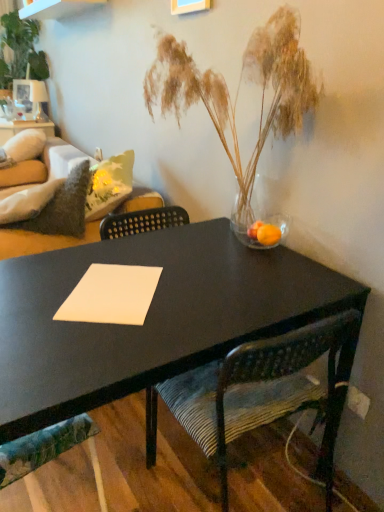
Question: Is textured fabric chair at lower left, which is counted as the 1th chair, starting from the left, at the left side of velvet green couch at left?

Choices:
 (A) yes
 (B) no

Answer: (B)

Question: Does textured fabric chair at lower left, which is counted as the 1th chair, starting from the left, come in front of velvet green couch at left?

Choices:
 (A) no
 (B) yes

Answer: (B)

Question: From a real-world perspective, is textured fabric chair at lower left, which is counted as the 1th chair, starting from the left, located beneath velvet green couch at left?

Choices:
 (A) yes
 (B) no

Answer: (A)

Question: Is textured fabric chair at lower left, which is counted as the 1th chair, starting from the left, surrounding velvet green couch at left?

Choices:
 (A) no
 (B) yes

Answer: (A)

Question: Is textured fabric chair at lower left, which is counted as the 1th chair, starting from the left, smaller than velvet green couch at left?

Choices:
 (A) yes
 (B) no

Answer: (A)

Question: Does textured fabric chair at lower left, arranged as the second chair when viewed from the right, turn towards velvet green couch at left?

Choices:
 (A) yes
 (B) no

Answer: (B)

Question: Is textured fabric chair at lower left, which is counted as the 1th chair, starting from the left, inside white fluffy pillow at upper left?

Choices:
 (A) yes
 (B) no

Answer: (B)

Question: Is white fluffy pillow at upper left completely or partially outside of textured fabric chair at lower left, arranged as the second chair when viewed from the right?

Choices:
 (A) no
 (B) yes

Answer: (B)

Question: Is white fluffy pillow at upper left thinner than textured fabric chair at lower left, arranged as the second chair when viewed from the right?

Choices:
 (A) yes
 (B) no

Answer: (B)

Question: Is white fluffy pillow at upper left behind textured fabric chair at lower left, which is counted as the 1th chair, starting from the left?

Choices:
 (A) no
 (B) yes

Answer: (B)

Question: Are white fluffy pillow at upper left and textured fabric chair at lower left, which is counted as the 1th chair, starting from the left, far apart?

Choices:
 (A) yes
 (B) no

Answer: (A)

Question: Does white fluffy pillow at upper left have a lesser height compared to textured fabric chair at lower left, arranged as the second chair when viewed from the right?

Choices:
 (A) no
 (B) yes

Answer: (A)

Question: Is the depth of velvet green couch at left less than that of translucent glass vase with dried grasses at center?

Choices:
 (A) no
 (B) yes

Answer: (A)